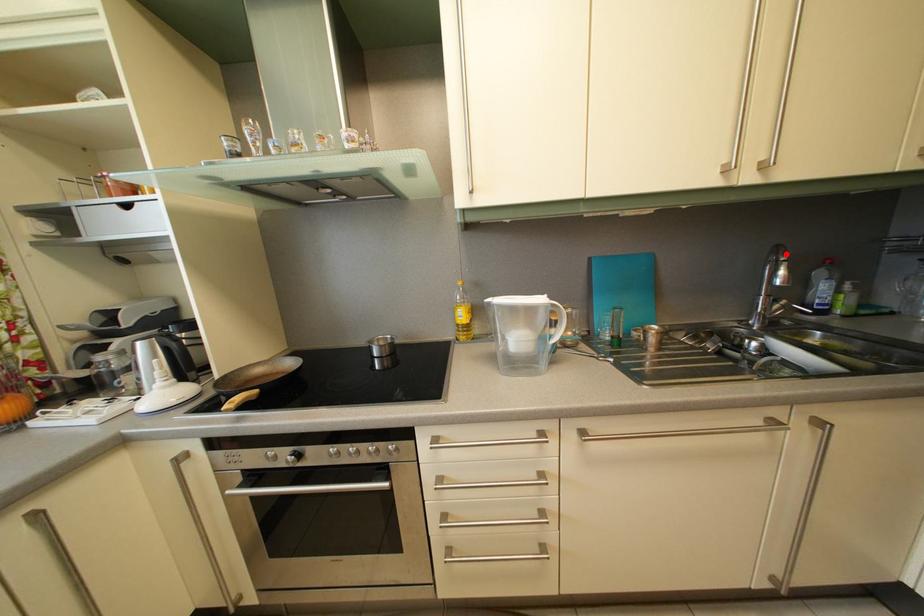
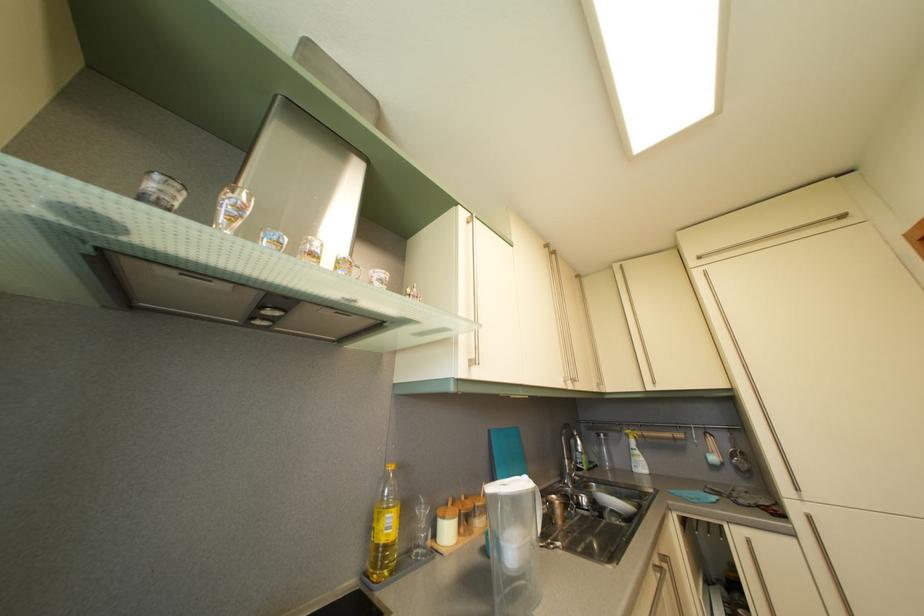
The point at the highlighted location is marked in the first image. Where is the corresponding point in the second image?

(575, 432)